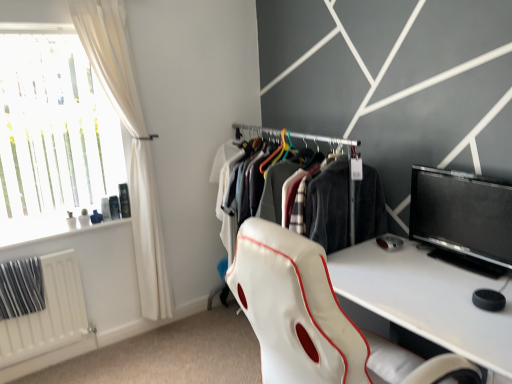
Identify the location of free space in front of black glossy monitor at right. (465, 289).